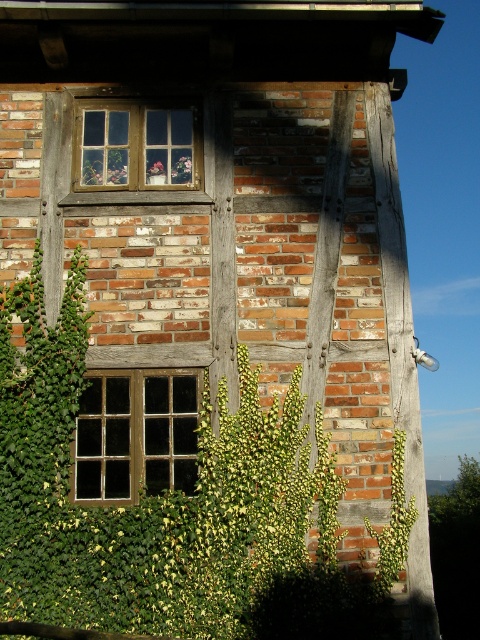
You are a painter who needs to reach the wooden window at lower left and the wooden frame at center to apply a fresh coat of paint. You have a ladder that is 5 feet long. Can you safely reach both objects with your ladder without moving it?

The wooden window at lower left is 5.37 feet from the wooden frame at center. Since the ladder is only 5 feet long, it is not long enough to span the distance between the two objects. You will need to move the ladder to reach both areas separately.

You are an architect assessing the structural integrity of the building. You notice the wooden window at lower left and the wooden frame at center. Which of these two wooden elements has a greater surface area?

The wooden window at lower left has a greater surface area than the wooden frame at center because it is larger in size according to the description.

You are standing in front of the rustic brick building and want to locate both the wooden window at lower left and the green leafy plant at right. Which object is positioned more to the east side of the building?

The wooden window at lower left is positioned more to the east side of the building since it is located to the left of the green leafy plant at right.